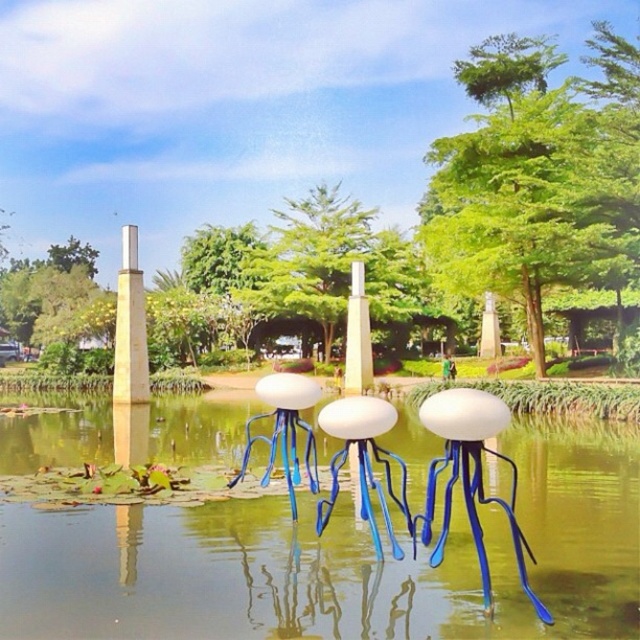
You are a visitor in the park and want to take a photo of both the translucent glass jellyfish at center and the yellow polished stone pillar at center. Which object should you focus on first if you want to capture both in the same frame without moving the camera?

The translucent glass jellyfish at center is shorter than the yellow polished stone pillar at center, so you should focus on the yellow polished stone pillar at center first to ensure both are in the frame.

You are standing at the edge of the pond in the park and want to take a photo of the transparent glass jellyfish at center. If you move 0.1 units to the right along the x axis, will you be closer to the jellyfish?

The transparent glass jellyfish at center is located at point (339, 561). Moving 0.1 units to the right along the x axis would increase your x coordinate. Since the jellyfish is at 0.877 on the x axis, moving right would take you away from it, so you would be farther away. Therefore, moving right would not bring you closer to the transparent glass jellyfish at center.